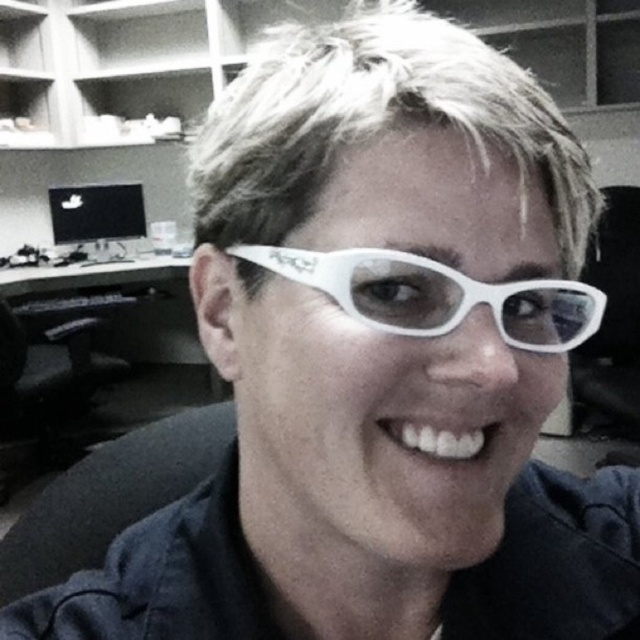
You are standing at the entrance of the office and want to sit down in the black fabric swivel chair at lower left. Based on your current position, which direction should you move to reach the chair?

Since the black fabric swivel chair at lower left is located at point (x=109, y=497), you should move towards the lower left direction to reach it.

You are standing in the office shown in the image. You need to sit down at the desk where the black Apple laptop is located. Which object at point (x=109, y=497) can you use to sit?

The black fabric swivel chair at lower left is located at point (x=109, y=497), which is near the desk with the black Apple laptop. You can use it to sit down.